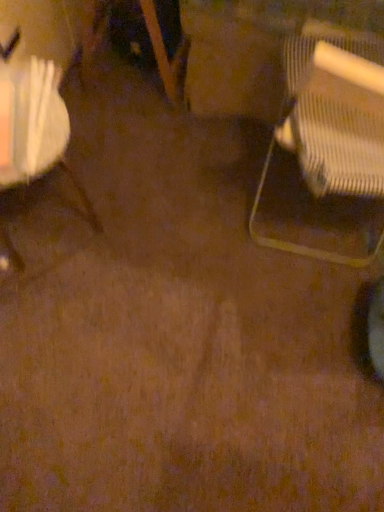
Question: From a real-world perspective, is white fabric bag at left, the second chair positioned from the right, beneath metallic mesh chair at right, placed as the second chair when sorted from left to right?

Choices:
 (A) no
 (B) yes

Answer: (B)

Question: Can you confirm if white fabric bag at left, which is the first chair in left-to-right order, is taller than metallic mesh chair at right, arranged as the first chair when viewed from the right?

Choices:
 (A) yes
 (B) no

Answer: (B)

Question: Is the position of white fabric bag at left, the second chair positioned from the right, more distant than that of metallic mesh chair at right, arranged as the first chair when viewed from the right?

Choices:
 (A) no
 (B) yes

Answer: (B)

Question: Does white fabric bag at left, which is the first chair in left-to-right order, appear on the right side of metallic mesh chair at right, placed as the second chair when sorted from left to right?

Choices:
 (A) no
 (B) yes

Answer: (A)

Question: Is white fabric bag at left, the second chair positioned from the right, thinner than metallic mesh chair at right, placed as the second chair when sorted from left to right?

Choices:
 (A) yes
 (B) no

Answer: (A)

Question: From the image's perspective, does white fabric bag at left, which is the first chair in left-to-right order, appear higher than metallic mesh chair at right, placed as the second chair when sorted from left to right?

Choices:
 (A) yes
 (B) no

Answer: (B)

Question: Considering the relative sizes of metallic mesh chair at right, arranged as the first chair when viewed from the right, and white fabric bag at left, the second chair positioned from the right, in the image provided, is metallic mesh chair at right, arranged as the first chair when viewed from the right, wider than white fabric bag at left, the second chair positioned from the right,?

Choices:
 (A) yes
 (B) no

Answer: (A)

Question: Is metallic mesh chair at right, arranged as the first chair when viewed from the right, beside white fabric bag at left, which is the first chair in left-to-right order?

Choices:
 (A) yes
 (B) no

Answer: (B)

Question: Considering the relative sizes of metallic mesh chair at right, arranged as the first chair when viewed from the right, and white fabric bag at left, which is the first chair in left-to-right order, in the image provided, is metallic mesh chair at right, arranged as the first chair when viewed from the right, taller than white fabric bag at left, which is the first chair in left-to-right order,?

Choices:
 (A) yes
 (B) no

Answer: (A)

Question: Is metallic mesh chair at right, placed as the second chair when sorted from left to right, shorter than white fabric bag at left, which is the first chair in left-to-right order?

Choices:
 (A) yes
 (B) no

Answer: (B)

Question: From the image's perspective, does metallic mesh chair at right, arranged as the first chair when viewed from the right, appear higher than white fabric bag at left, the second chair positioned from the right?

Choices:
 (A) yes
 (B) no

Answer: (A)

Question: From a real-world perspective, is metallic mesh chair at right, placed as the second chair when sorted from left to right, under white fabric bag at left, which is the first chair in left-to-right order?

Choices:
 (A) yes
 (B) no

Answer: (B)

Question: From the image's perspective, is white fabric bag at left, which is the first chair in left-to-right order, positioned above or below metallic mesh chair at right, placed as the second chair when sorted from left to right?

Choices:
 (A) below
 (B) above

Answer: (A)